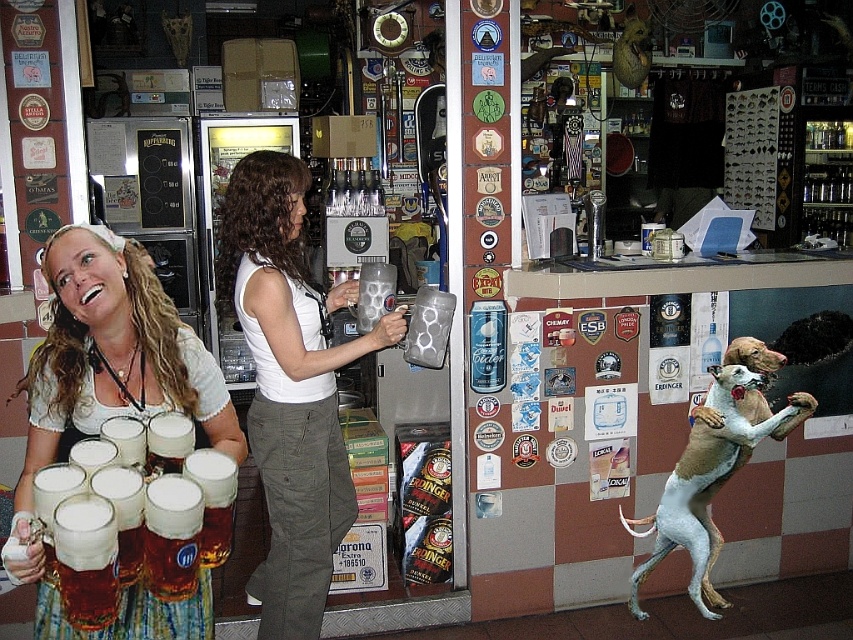
Which is more to the right, white cotton tank top at center or matte white blouse at center?

From the viewer's perspective, white cotton tank top at center appears more on the right side.

Does point (337, 356) come farther from viewer compared to point (209, 440)?

Yes, it is.

Measure the distance between point (300, 410) and camera.

Point (300, 410) and camera are 2.40 meters apart.

Locate an element on the screen. The height and width of the screenshot is (640, 853). white cotton tank top at center is located at coordinates (289, 387).

Which is behind, point (254, 163) or point (712, 560)?

The point (712, 560) is behind.

How much distance is there between white cotton tank top at center and light brown fur at lower right?

4.12 feet

The height and width of the screenshot is (640, 853). What do you see at coordinates (289, 387) in the screenshot? I see `white cotton tank top at center` at bounding box center [289, 387].

In order to click on white cotton tank top at center in this screenshot , I will do `click(289, 387)`.

Is matte white blouse at center taller than light brown fur at lower right?

In fact, matte white blouse at center may be shorter than light brown fur at lower right.

Identify the location of matte white blouse at center. This screenshot has width=853, height=640. (112, 404).

The width and height of the screenshot is (853, 640). In order to click on matte white blouse at center in this screenshot , I will do `click(112, 404)`.